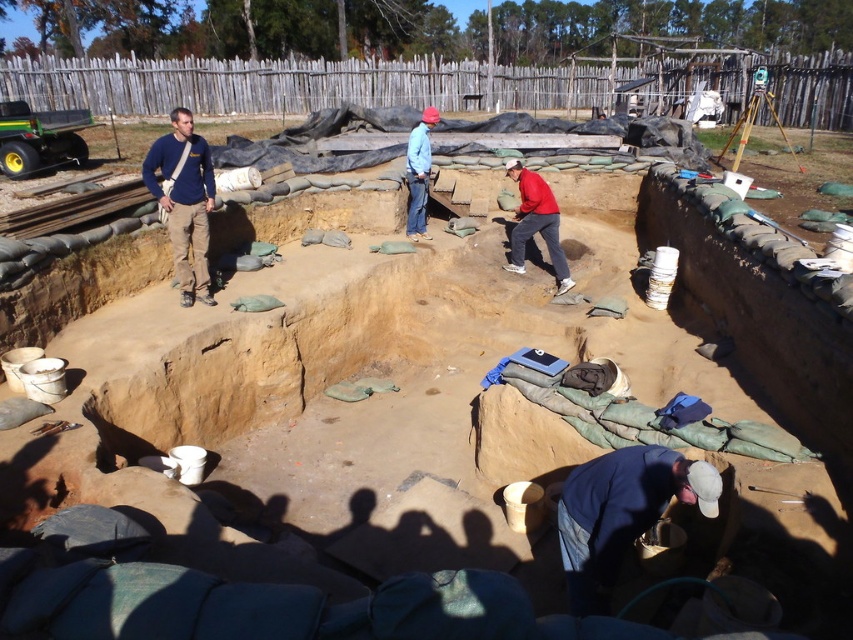
You are an archaeologist at the excavation site. You need to locate the blue cotton shirt at upper left. Where would you look relative to the red matte jacket at center?

The blue cotton shirt at upper left is located below the red matte jacket at center, so you should look downward from the red matte jacket at center to find it.

You are an archaeologist at the excavation site. You need to retrieve an item from the blue denim jacket at lower right without disturbing the blue cotton shirt at upper left. Is the jacket accessible without moving the shirt?

The blue denim jacket at lower right is in front of the blue cotton shirt at upper left, so you can access the jacket without moving the shirt.

You are an archaeologist working at the excavation site. You need to store your blue denim jacket at lower right and red matte jacket at center in a storage box. The box can only hold one of them. Which jacket should you choose to fit in the box?

The blue denim jacket at lower right occupies less space than the red matte jacket at center, so it will fit in the storage box.